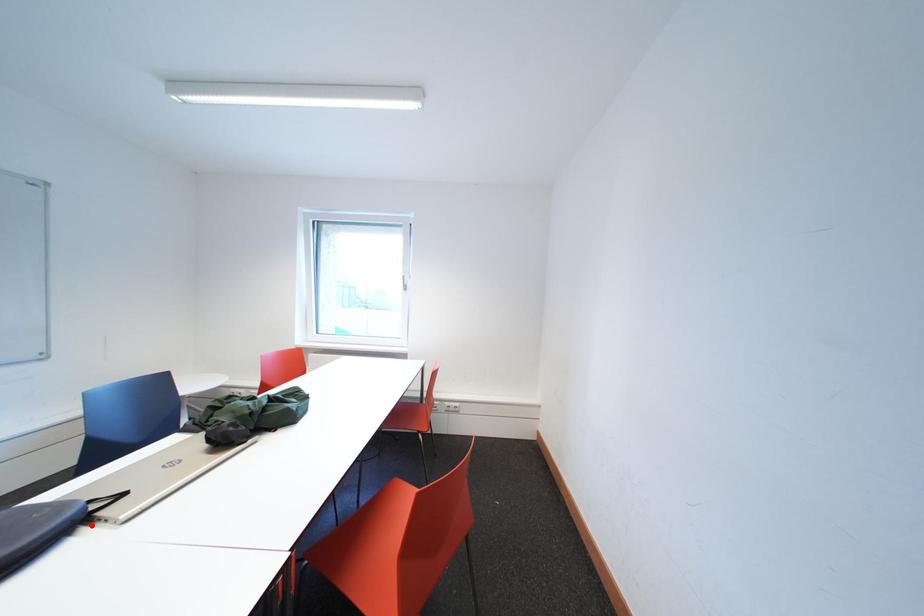
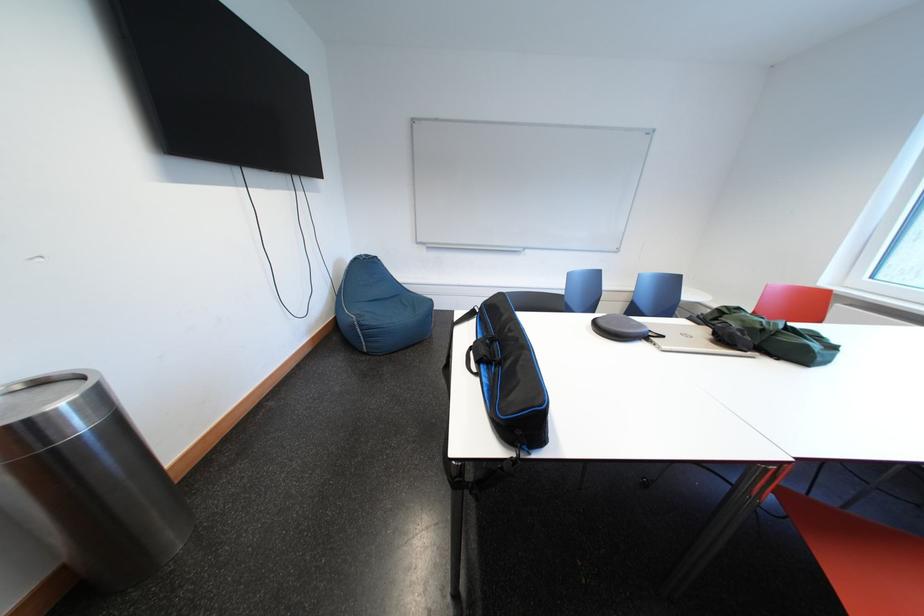
The point at the highlighted location is marked in the first image. Where is the corresponding point in the second image?

(657, 341)